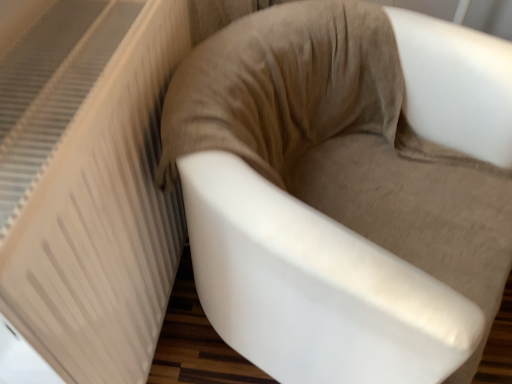
Question: Is suede-like beige chair at center bigger or smaller than white textured radiator at left?

Choices:
 (A) small
 (B) big

Answer: (B)

Question: Is suede-like beige chair at center taller or shorter than white textured radiator at left?

Choices:
 (A) tall
 (B) short

Answer: (B)

Question: Is suede-like beige chair at center spatially inside white textured radiator at left, or outside of it?

Choices:
 (A) inside
 (B) outside

Answer: (B)

Question: Is white textured radiator at left bigger or smaller than suede-like beige chair at center?

Choices:
 (A) big
 (B) small

Answer: (B)

Question: Is white textured radiator at left taller or shorter than suede-like beige chair at center?

Choices:
 (A) short
 (B) tall

Answer: (B)

Question: Relative to suede-like beige chair at center, is white textured radiator at left in front or behind?

Choices:
 (A) front
 (B) behind

Answer: (A)

Question: From the image's perspective, relative to suede-like beige chair at center, is white textured radiator at left above or below?

Choices:
 (A) below
 (B) above

Answer: (B)